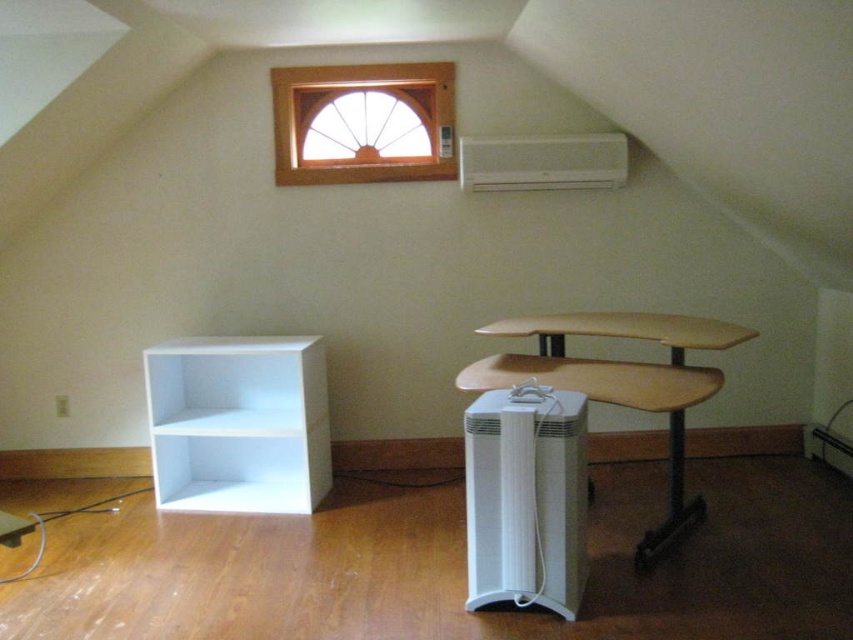
In the scene shown: Does white matte bookshelf at lower left appear under wooden window at upper center?

Correct, white matte bookshelf at lower left is located below wooden window at upper center.

This screenshot has width=853, height=640. Describe the element at coordinates (238, 422) in the screenshot. I see `white matte bookshelf at lower left` at that location.

Is point (296, 460) positioned in front of point (442, 148)?

No, (296, 460) is further to viewer.

Where is `white matte bookshelf at lower left`? white matte bookshelf at lower left is located at coordinates (238, 422).

Can you confirm if wooden window at upper center is positioned to the right of white plastic air conditioner at upper center?

Incorrect, wooden window at upper center is not on the right side of white plastic air conditioner at upper center.

Does point (413, 104) lie behind point (608, 148)?

Yes, point (413, 104) is behind point (608, 148).

Is point (351, 74) farther from camera compared to point (596, 140)?

That is True.

You are a GUI agent. You are given a task and a screenshot of the screen. Output one action in this format:
    pyautogui.click(x=<x>, y=<y>)
    Task: Click on the wooden window at upper center
    Image resolution: width=853 pixels, height=640 pixels.
    Given the screenshot: What is the action you would take?
    pyautogui.click(x=363, y=122)

Can you confirm if white matte bookshelf at lower left is shorter than wooden desk at center?

Yes, white matte bookshelf at lower left is shorter than wooden desk at center.

Which is behind, point (210, 468) or point (699, 348)?

The point (210, 468) is behind.

Between point (173, 392) and point (618, 392), which one is positioned in front?

Point (618, 392)

At what (x,y) coordinates should I click in order to perform the action: click on white matte bookshelf at lower left. Please return your answer as a coordinate pair (x, y). The image size is (853, 640). Looking at the image, I should click on (238, 422).